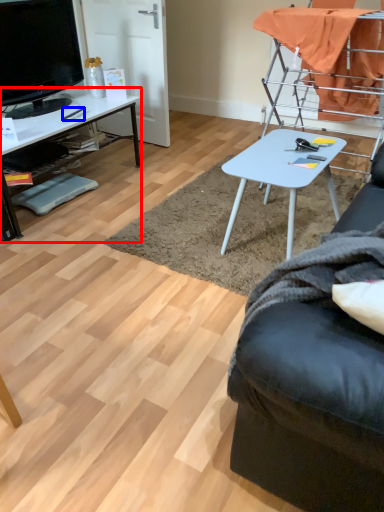
Question: Among these objects, which one is farthest to the camera, desk (highlighted by a red box) or pen (highlighted by a blue box)?

Choices:
 (A) desk
 (B) pen

Answer: (B)